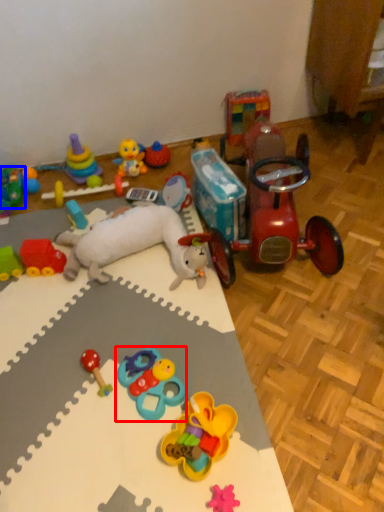
Question: Which point is closer to the camera, toy (highlighted by a red box) or toy (highlighted by a blue box)?

Choices:
 (A) toy
 (B) toy

Answer: (A)